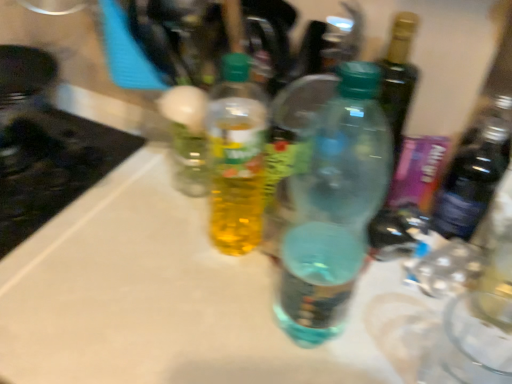
You are a GUI agent. You are given a task and a screenshot of the screen. Output one action in this format:
    pyautogui.click(x=<x>, y=<y>)
    Task: Click on the free spot to the right of translucent plastic bottle at center, acting as the 1th bottle starting from the right
    This screenshot has width=512, height=384.
    Given the screenshot: What is the action you would take?
    (387, 334)